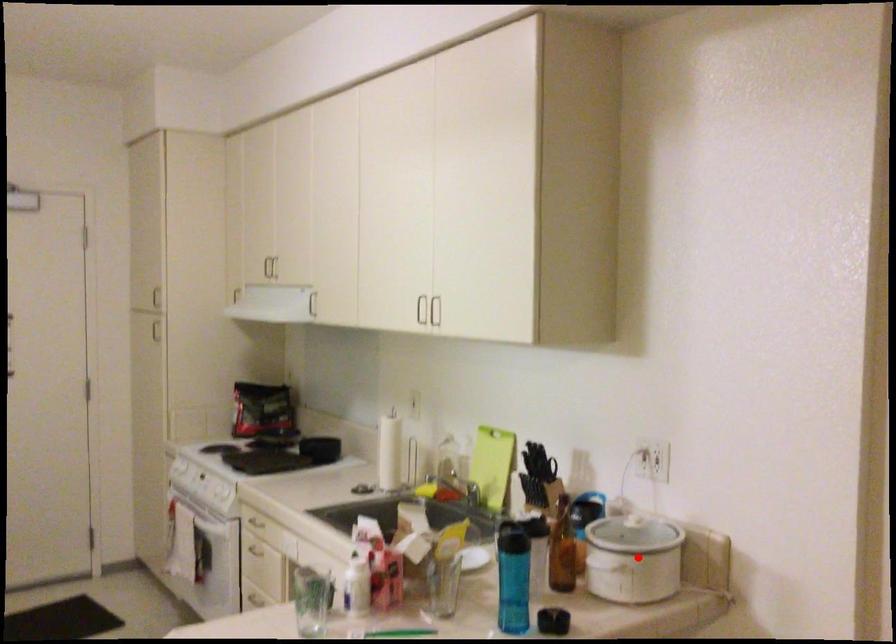
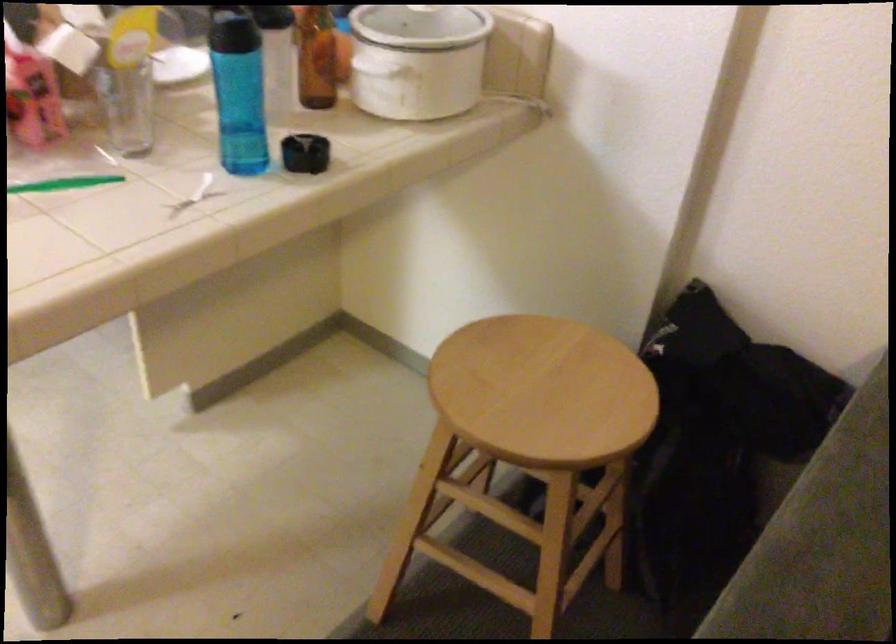
Question: I am providing you with two images of the same scene from different viewpoints. Given a red point in image1, look at the same physical point in image2. Is it:

Choices:
 (A) Closer to the viewpoint
 (B) Farther from the viewpoint

Answer: (A)